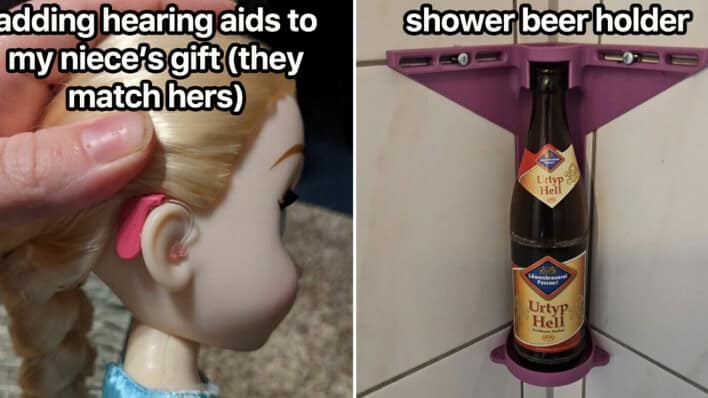
The height and width of the screenshot is (398, 708). I want to click on text "shower beer holder", so click(x=469, y=16).